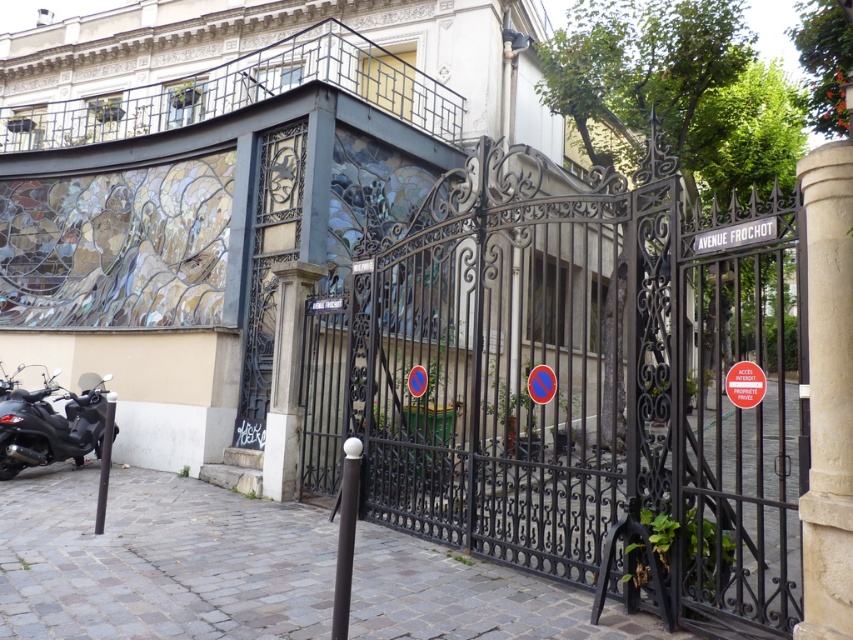
You are standing in front of the building with the mosaic wall and the wrought iron gate. There is a point marked at coordinates (577, 385). What object is located at that point?

The point at coordinates (577, 385) corresponds to the black wrought iron gate at center.

You are standing at the entrance of the building and want to locate the black wrought iron gate at center. According to the coordinates provided, where exactly is it positioned in the image?

The black wrought iron gate at center is positioned at coordinates point (577, 385).